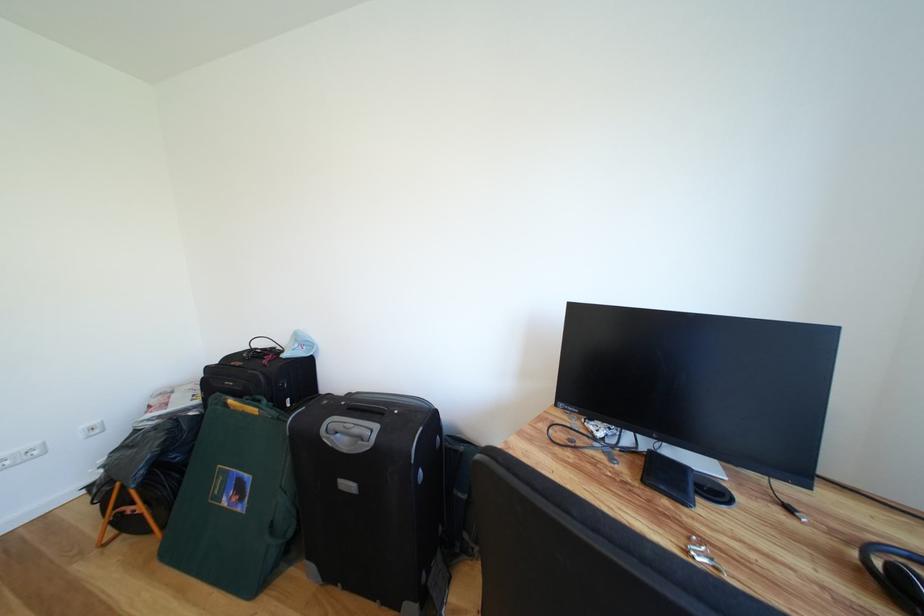
Find the location of `silver keys`. silver keys is located at coordinates tap(701, 554).